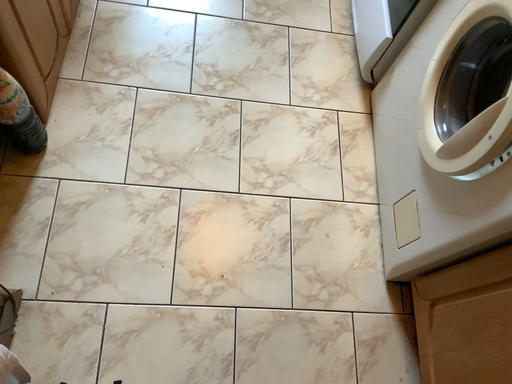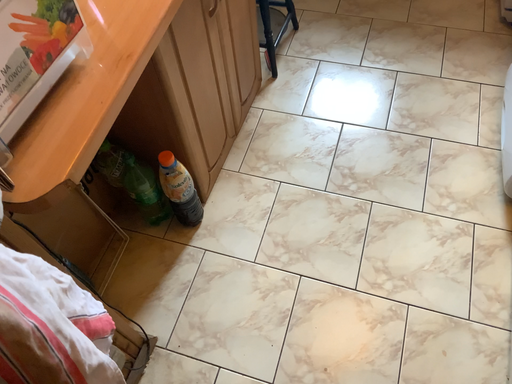
Question: How did the camera likely rotate when shooting the video?

Choices:
 (A) rotated downward
 (B) rotated upward

Answer: (B)